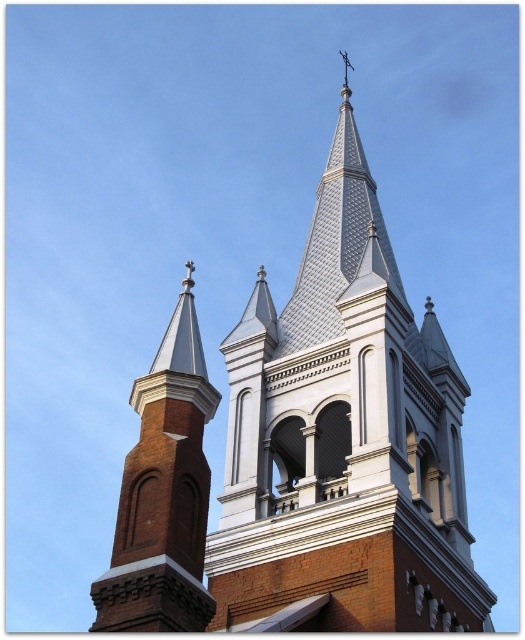
Question: Can you confirm if white textured steeple at center is bigger than red brick tower at left?

Choices:
 (A) yes
 (B) no

Answer: (A)

Question: Which object is closer to the camera taking this photo?

Choices:
 (A) red brick tower at left
 (B) white textured steeple at center

Answer: (B)

Question: Which of the following is the closest to the observer?

Choices:
 (A) (x=184, y=436)
 (B) (x=301, y=627)

Answer: (A)

Question: Is white textured steeple at center above red brick tower at left?

Choices:
 (A) yes
 (B) no

Answer: (A)

Question: Among these points, which one is nearest to the camera?

Choices:
 (A) (202, 417)
 (B) (246, 451)

Answer: (A)

Question: Can you confirm if white textured steeple at center is bigger than red brick tower at left?

Choices:
 (A) yes
 (B) no

Answer: (A)